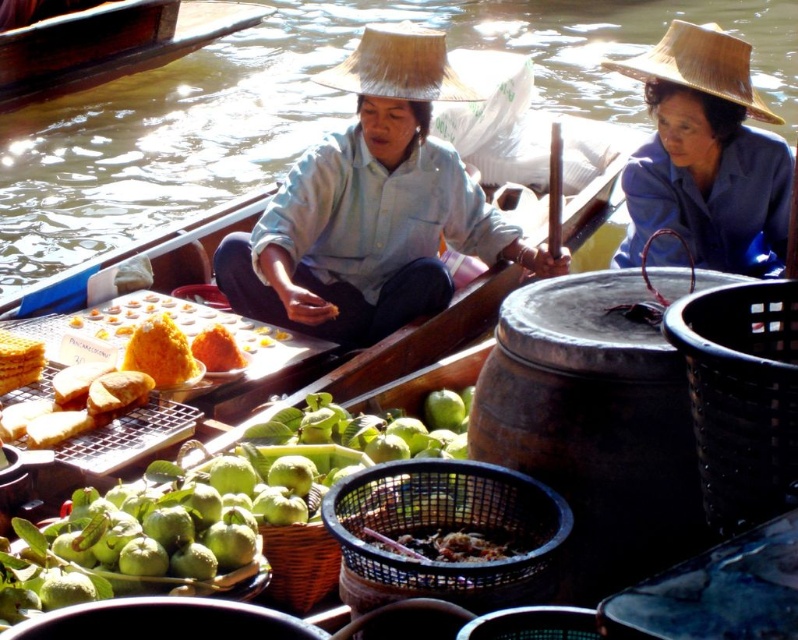
Question: Which point appears farthest from the camera in this image?

Choices:
 (A) (311, 588)
 (B) (239, 20)

Answer: (B)

Question: Is natural straw hat at center bigger than brown woven basket at center?

Choices:
 (A) no
 (B) yes

Answer: (B)

Question: Is black woven basket at lower right smaller than wooden boat at upper left?

Choices:
 (A) yes
 (B) no

Answer: (A)

Question: Is natural straw hat at upper center positioned behind brown woven basket at center?

Choices:
 (A) yes
 (B) no

Answer: (A)

Question: Which object is positioned closest to the natural straw hat at center?

Choices:
 (A) natural straw hat at upper center
 (B) matte light blue shirt at center

Answer: (B)

Question: Which point is closer to the camera taking this photo?

Choices:
 (A) (45, 22)
 (B) (453, 545)
 (C) (271, 577)
 (D) (733, 64)

Answer: (B)